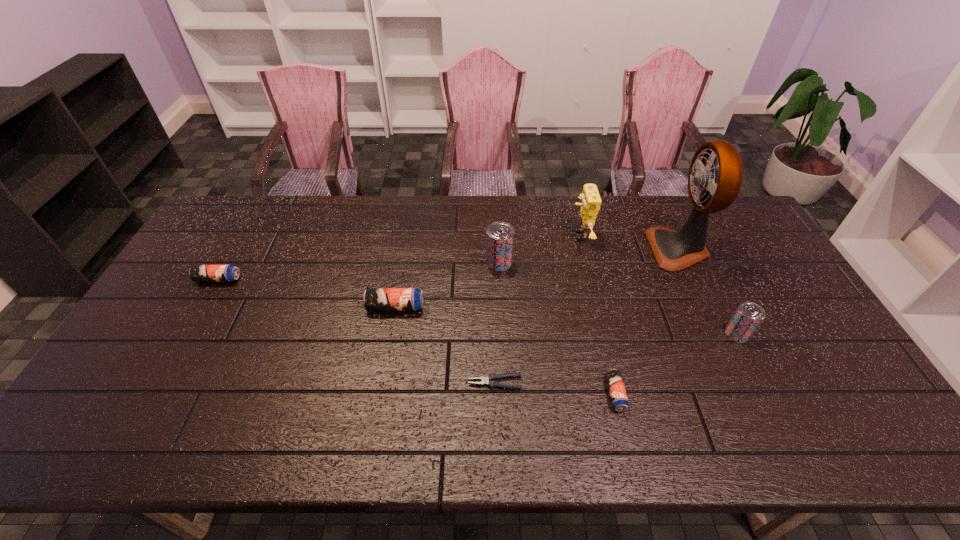
Locate an element on the screen. The width and height of the screenshot is (960, 540). free space between the second tallest object and the seventh object from right to left is located at coordinates (488, 272).

You are a GUI agent. You are given a task and a screenshot of the screen. Output one action in this format:
    pyautogui.click(x=<x>, y=<y>)
    Task: Click on the blank region between the shortest object and the nearer red beer can
    The width and height of the screenshot is (960, 540).
    Given the screenshot: What is the action you would take?
    pyautogui.click(x=616, y=358)

At what (x,y) coordinates should I click in order to perform the action: click on free point between the second beer can from right to left and the gray pliers. Please return your answer as a coordinate pair (x, y). Looking at the image, I should click on (555, 388).

Where is `empty space that is in between the second tallest object and the smaller red beer can`? The image size is (960, 540). empty space that is in between the second tallest object and the smaller red beer can is located at coordinates (659, 285).

You are a GUI agent. You are given a task and a screenshot of the screen. Output one action in this format:
    pyautogui.click(x=<x>, y=<y>)
    Task: Click on the free space between the fan and the sponge
    Image resolution: width=960 pixels, height=540 pixels.
    Given the screenshot: What is the action you would take?
    pyautogui.click(x=629, y=242)

Locate an element on the screen. vacant space that's between the third shortest object and the left red beer can is located at coordinates (359, 271).

Locate an element on the screen. The width and height of the screenshot is (960, 540). free space that is in between the fan and the farther red beer can is located at coordinates (588, 255).

Choose which object is the second nearest neighbor to the sixth farthest object. Please provide its 2D coordinates. Your answer should be formatted as a tuple, i.e. [(x, y)], where the tuple contains the x and y coordinates of a point satisfying the conditions above.

[(618, 395)]

Locate an element on the screen. The height and width of the screenshot is (540, 960). object that is the closest to the sixth shortest object is located at coordinates (591, 201).

Locate an element on the screen. the third closest beer can to the sixth shortest object is located at coordinates (748, 316).